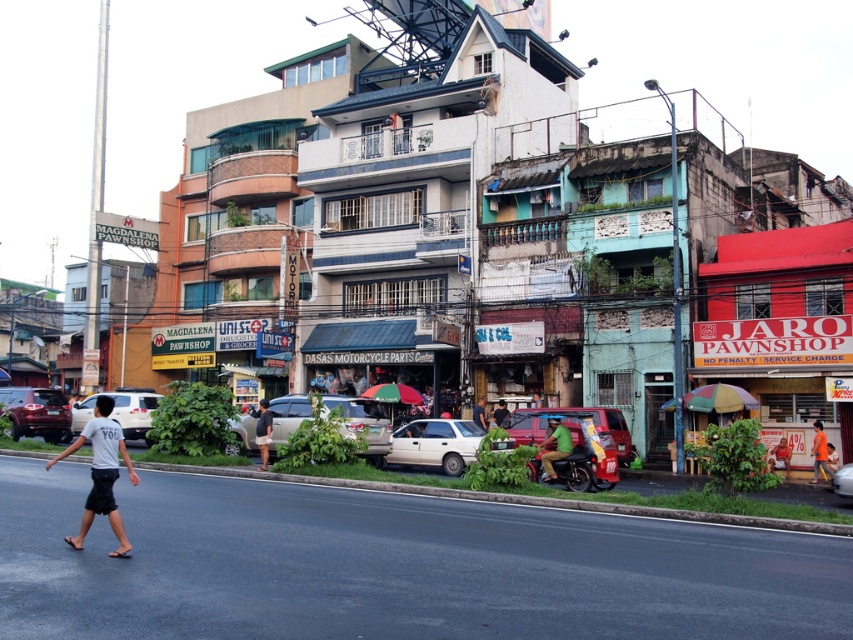
You are a delivery driver who needs to park your matte red suv at center near the red matte pawnshop at right. Can you estimate if the space between the two will be sufficient for your vehicle?

The red matte pawnshop at right is smaller than the matte red suv at center, so the space between them may be adequate for parking the matte red suv at center, but the exact dimensions are unclear without more information.

You are a tourist standing on the sidewalk and see the red matte pawnshop at right and the orange shirt at center. Which object is closer to you?

The red matte pawnshop at right is closer to you than the orange shirt at center.

You are a pedestrian standing on the sidewalk and you see a white matte sedan at center and a dark green shirt at center. Which object is larger in size?

The white matte sedan at center is bigger than the dark green shirt at center.